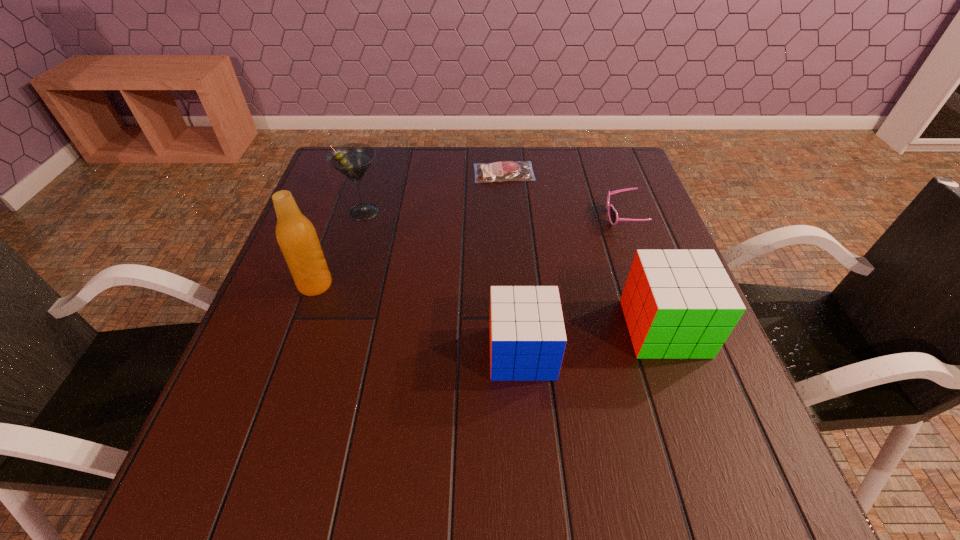
Find the location of `vacant space located on the back of the shorter cube`. vacant space located on the back of the shorter cube is located at coordinates (515, 262).

The width and height of the screenshot is (960, 540). Identify the location of vacant area located on the back of the fourth shortest object. (635, 247).

In order to click on vacant space situated 0.110m on the left of the shortest object in this screenshot , I will do `click(436, 173)`.

Locate an element on the screen. The image size is (960, 540). free point located 0.140m on the front-facing side of the sunglasses is located at coordinates (551, 217).

Where is `vacant point located 0.130m on the front-facing side of the sunglasses`? vacant point located 0.130m on the front-facing side of the sunglasses is located at coordinates (555, 217).

Where is `vacant region located on the front-facing side of the sunglasses`? This screenshot has width=960, height=540. vacant region located on the front-facing side of the sunglasses is located at coordinates (517, 217).

Identify the location of free space located 0.140m on the back of the fifth shortest object. (376, 171).

The image size is (960, 540). I want to click on vacant area located on the front of the tallest object, so (x=282, y=378).

Locate an element on the screen. object that is at the far edge is located at coordinates (501, 171).

You are a GUI agent. You are given a task and a screenshot of the screen. Output one action in this format:
    pyautogui.click(x=<x>, y=<y>)
    Task: Click on the martini that is at the left edge
    
    Given the screenshot: What is the action you would take?
    pyautogui.click(x=352, y=160)